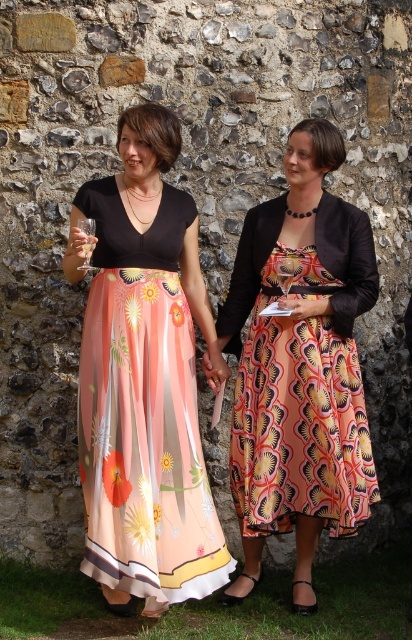
Is clear glass wine glass at center to the left of clear glass wine glass at left from the viewer's perspective?

In fact, clear glass wine glass at center is to the right of clear glass wine glass at left.

Can you confirm if clear glass wine glass at center is bigger than clear glass wine glass at left?

No, clear glass wine glass at center is not bigger than clear glass wine glass at left.

Between point (283, 275) and point (77, 227), which one is positioned in front?

Point (77, 227) is in front.

The image size is (412, 640). I want to click on clear glass wine glass at center, so click(285, 275).

Does matte black dress at center come in front of clear glass wine glass at left?

That is False.

Can you confirm if matte black dress at center is smaller than clear glass wine glass at left?

No, matte black dress at center is not smaller than clear glass wine glass at left.

Between point (362, 292) and point (89, 268), which one is positioned behind?

The point (362, 292) is more distant.

This screenshot has width=412, height=640. I want to click on matte black dress at center, so click(299, 365).

Between point (126, 566) and point (295, 422), which one is positioned behind?

The point (295, 422) is behind.

Is matte floral skirt at center below matte black dress at center?

Actually, matte floral skirt at center is above matte black dress at center.

Which is behind, point (168, 132) or point (292, 506)?

Positioned behind is point (292, 506).

What are the coordinates of `matte floral skirt at center` in the screenshot? It's located at (145, 378).